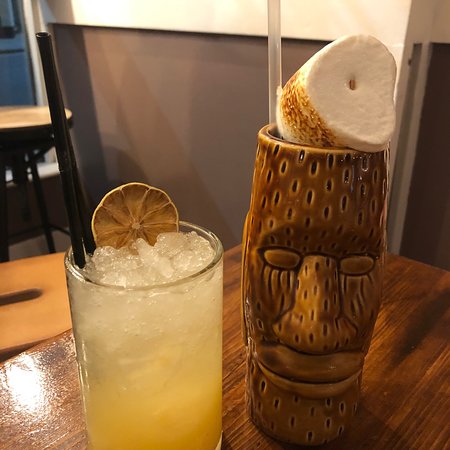
Where is `wall`? The width and height of the screenshot is (450, 450). wall is located at coordinates (426, 158), (443, 32), (226, 15), (201, 92), (18, 214), (54, 203), (52, 228), (29, 233).